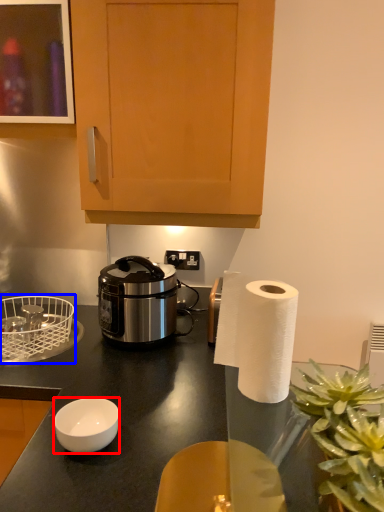
Question: Which of the following is the farthest to the observer, bowl (highlighted by a red box) or basket (highlighted by a blue box)?

Choices:
 (A) bowl
 (B) basket

Answer: (B)